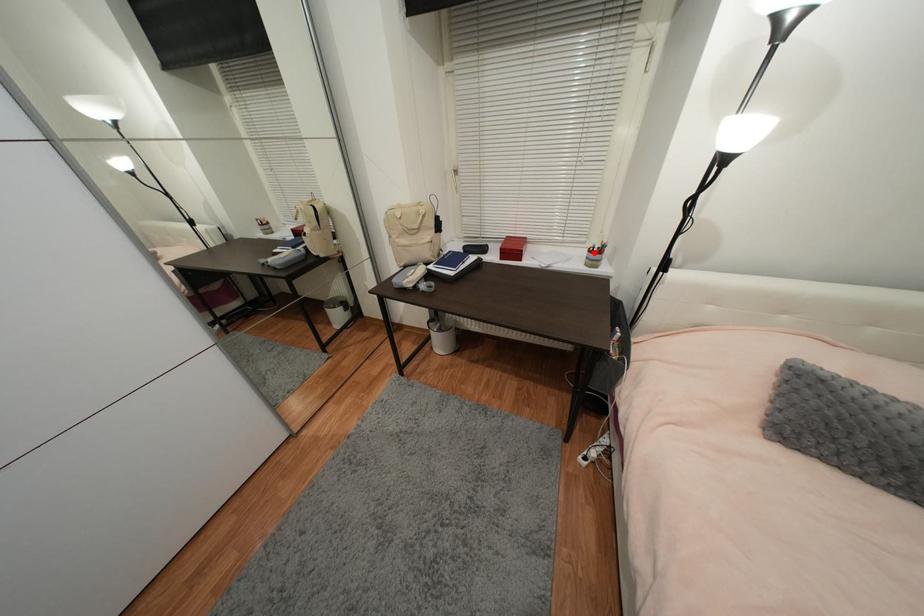
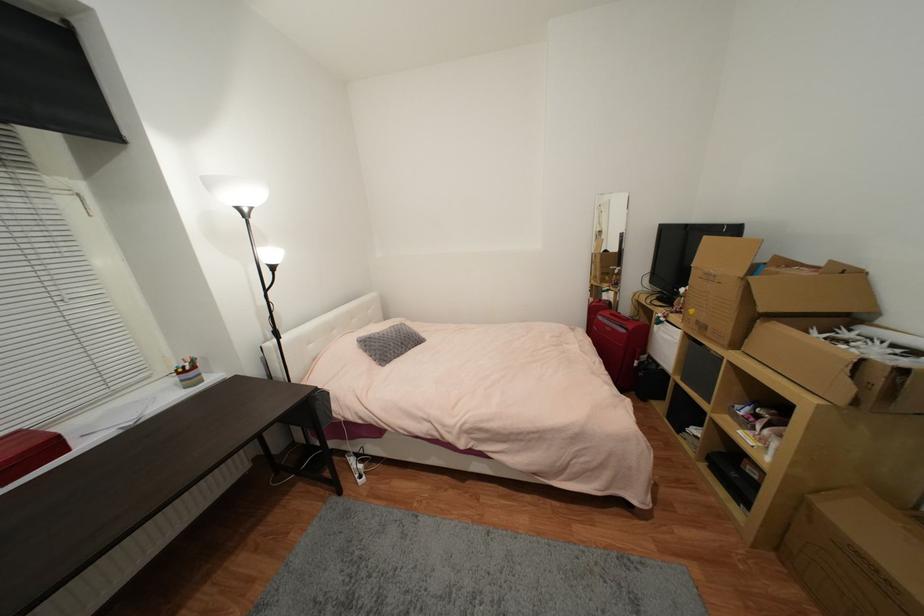
Find the pixel in the second image that matches the highlighted location in the first image.

(185, 374)